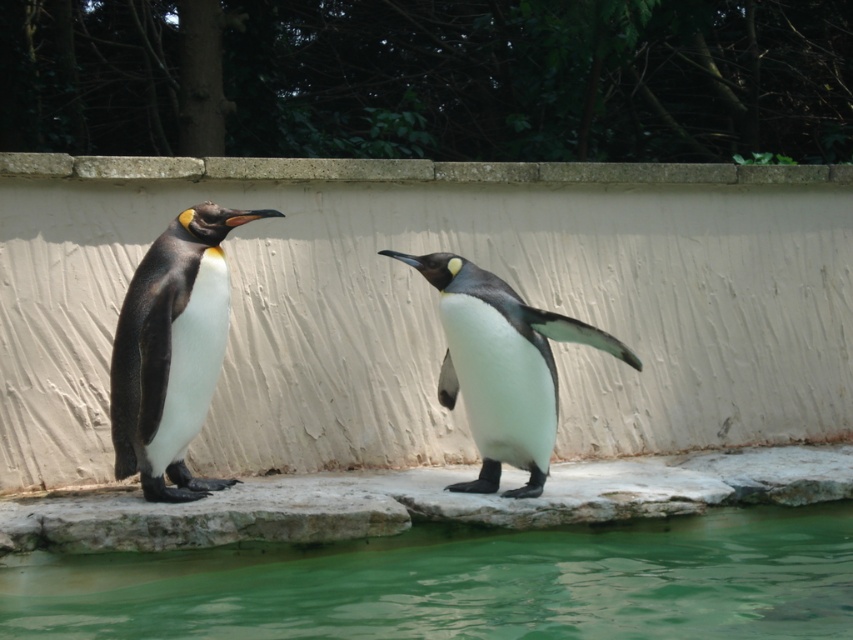
Question: Does green liquid water at lower center appear over white matte penguin at center?

Choices:
 (A) yes
 (B) no

Answer: (B)

Question: Based on their relative distances, which object is nearer to the smooth concrete ledge at upper center?

Choices:
 (A) white matte penguin at center
 (B) matte black penguin at left
 (C) green liquid water at lower center

Answer: (B)

Question: Which of the following is the closest to the observer?

Choices:
 (A) white matte penguin at center
 (B) smooth concrete ledge at upper center
 (C) green liquid water at lower center

Answer: (C)

Question: Among these points, which one is nearest to the camera?

Choices:
 (A) (204, 241)
 (B) (244, 573)

Answer: (B)

Question: Is white matte penguin at center further to camera compared to smooth concrete ledge at upper center?

Choices:
 (A) no
 (B) yes

Answer: (A)

Question: Is green liquid water at lower center smaller than smooth concrete ledge at upper center?

Choices:
 (A) no
 (B) yes

Answer: (A)